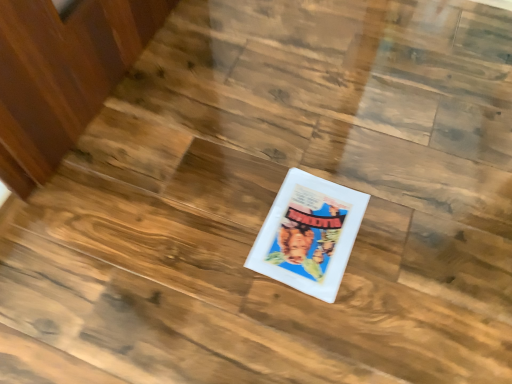
Find the location of a particular element. The height and width of the screenshot is (384, 512). free space above white glossy book at center (from a real-world perspective) is located at coordinates (309, 224).